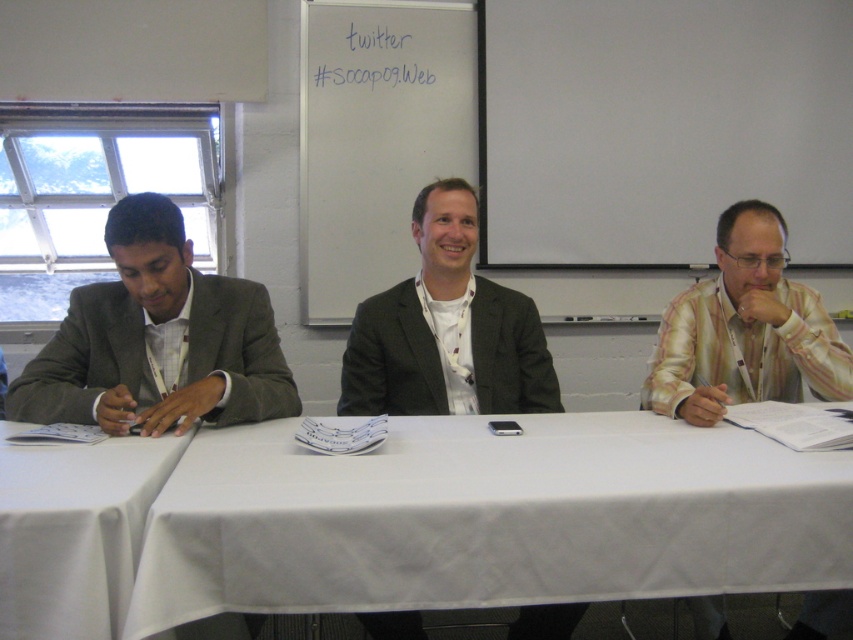
Which is in front, point (55, 349) or point (482, 358)?

Point (55, 349)

Measure the distance between point (x=141, y=312) and camera.

The distance of point (x=141, y=312) from camera is 1.91 meters.

Is point (196, 330) in front of point (486, 342)?

Yes, it is.

At what (x,y) coordinates should I click in order to perform the action: click on matte gray suit at left. Please return your answer as a coordinate pair (x, y). The image size is (853, 640). Looking at the image, I should click on (82, 356).

Between white cloth at left and matte gray suit at left, which one has less height?

Standing shorter between the two is white cloth at left.

Between white cloth at left and matte gray suit at left, which one has more height?

matte gray suit at left

Does point (109, 524) come closer to viewer compared to point (103, 321)?

Yes, point (109, 524) is in front of point (103, 321).

The image size is (853, 640). I want to click on white cloth at left, so click(74, 531).

Looking at this image, can you confirm if white cloth at center is taller than matte gray suit at left?

No, white cloth at center is not taller than matte gray suit at left.

Which is behind, point (206, 611) or point (241, 282)?

The point (241, 282) is more distant.

Image resolution: width=853 pixels, height=640 pixels. I want to click on white cloth at center, so click(489, 518).